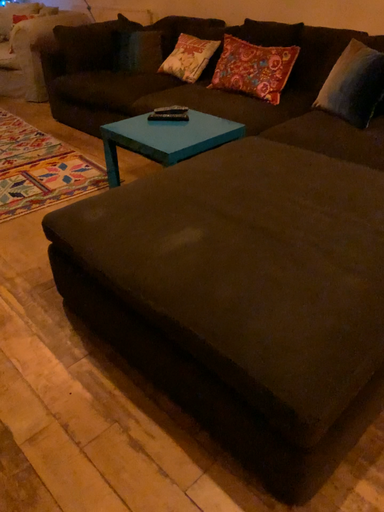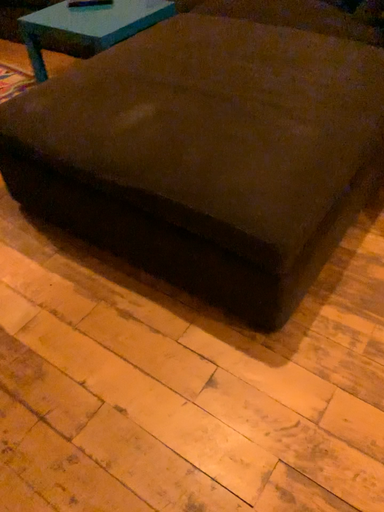
Question: How did the camera likely rotate when shooting the video?

Choices:
 (A) rotated right
 (B) rotated left

Answer: (A)